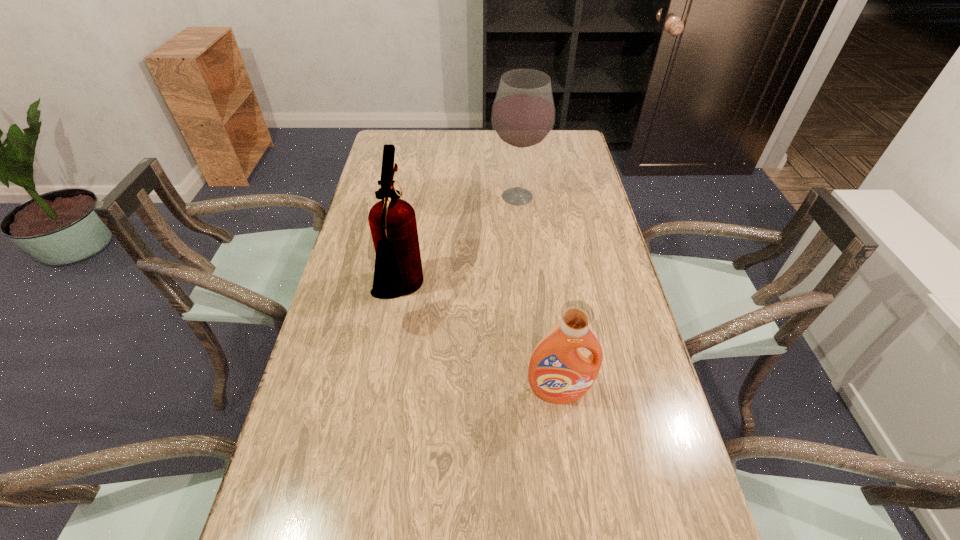
Locate an element on the screen. vacant region at the far edge is located at coordinates (511, 159).

In order to click on free space at the left edge of the desktop in this screenshot , I will do `click(324, 467)`.

This screenshot has height=540, width=960. I want to click on free space at the right edge of the desktop, so click(x=628, y=347).

This screenshot has height=540, width=960. Identify the location of vacant region at the far left corner of the desktop. (404, 159).

Where is `vacant space at the far right corner of the desktop`? vacant space at the far right corner of the desktop is located at coordinates (579, 154).

The height and width of the screenshot is (540, 960). Find the location of `empty space between the leftmost object and the detergent`. empty space between the leftmost object and the detergent is located at coordinates (480, 342).

Locate an element on the screen. The width and height of the screenshot is (960, 540). vacant space that is in between the nearest object and the second nearest object is located at coordinates (480, 342).

Where is `unoccupied position between the detergent and the alcohol`? This screenshot has height=540, width=960. unoccupied position between the detergent and the alcohol is located at coordinates (538, 294).

You are a GUI agent. You are given a task and a screenshot of the screen. Output one action in this format:
    pyautogui.click(x=<x>, y=<y>)
    Task: Click on the free space between the second farthest object and the detergent
    The width and height of the screenshot is (960, 540).
    Given the screenshot: What is the action you would take?
    pyautogui.click(x=480, y=342)

Locate an element on the screen. This screenshot has width=960, height=540. vacant space that is in between the second nearest object and the farthest object is located at coordinates (460, 245).